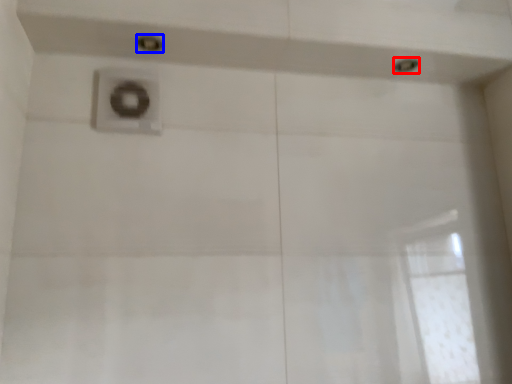
Question: Which object appears closest to the camera in this image, shower (highlighted by a red box) or shower (highlighted by a blue box)?

Choices:
 (A) shower
 (B) shower

Answer: (B)